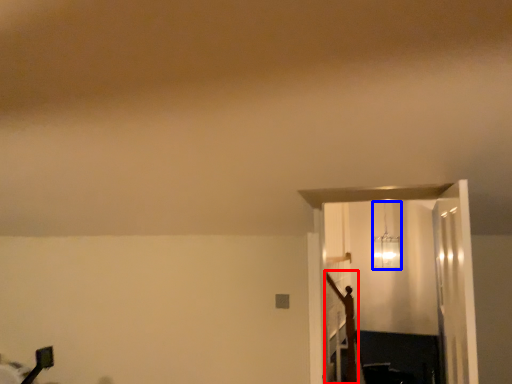
Question: Which object is closer to the camera taking this photo, crucifix (highlighted by a red box) or lamp (highlighted by a blue box)?

Choices:
 (A) crucifix
 (B) lamp

Answer: (A)